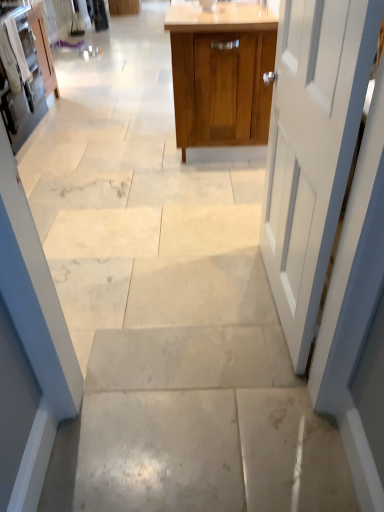
The width and height of the screenshot is (384, 512). In order to click on vacant area that is situated to the right of matte white cabinet at left, which is counted as the second cabinetry, starting from the left in this screenshot , I will do `click(91, 136)`.